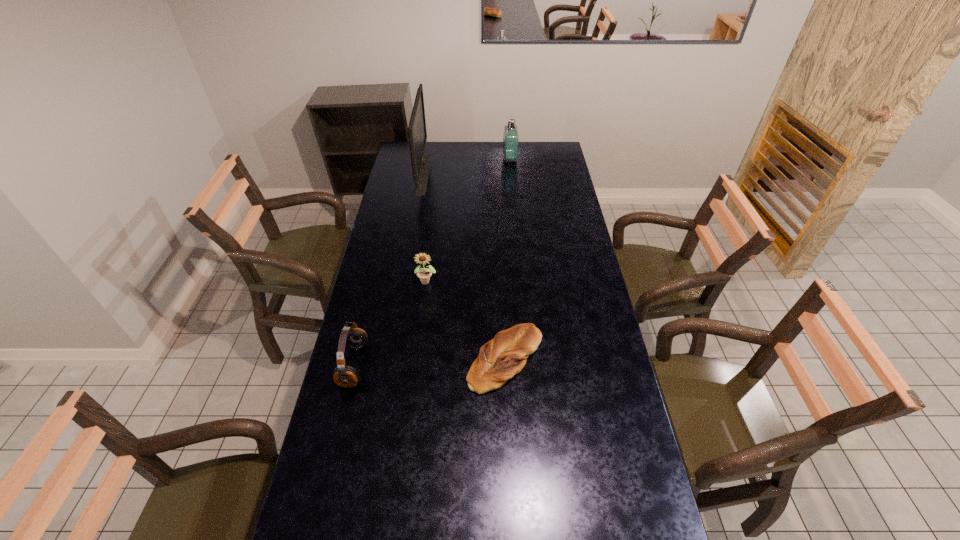
Locate an element on the screen. The image size is (960, 540). vacant space that is in between the fourth shortest object and the bread is located at coordinates (508, 259).

Where is `free area in between the perfume and the sunflower`? free area in between the perfume and the sunflower is located at coordinates (468, 220).

Where is `object that is the second closest one to the bread`? The image size is (960, 540). object that is the second closest one to the bread is located at coordinates [356, 338].

Find the location of a particular element. This screenshot has width=960, height=540. object that is the second closest one to the headset is located at coordinates pyautogui.click(x=501, y=358).

Where is `vacant space that satisfies the following two spatial constraints: 1. on the front-facing side of the tallest object; 2. on the back side of the shortest object`? vacant space that satisfies the following two spatial constraints: 1. on the front-facing side of the tallest object; 2. on the back side of the shortest object is located at coordinates (392, 360).

Where is `free space that satisfies the following two spatial constraints: 1. on the front label of the second tallest object; 2. on the front-facing side of the third nearest object`? This screenshot has width=960, height=540. free space that satisfies the following two spatial constraints: 1. on the front label of the second tallest object; 2. on the front-facing side of the third nearest object is located at coordinates (521, 281).

Locate an element on the screen. vacant space that satisfies the following two spatial constraints: 1. on the front label of the perfume; 2. on the front-facing side of the third object from right to left is located at coordinates click(x=521, y=281).

Identify the location of vacant space that satisfies the following two spatial constraints: 1. on the front label of the second tallest object; 2. on the front side of the shortest object. This screenshot has width=960, height=540. (528, 360).

The width and height of the screenshot is (960, 540). Find the location of `vacant space that satisfies the following two spatial constraints: 1. on the front-facing side of the shortest object; 2. on the right side of the monitor`. vacant space that satisfies the following two spatial constraints: 1. on the front-facing side of the shortest object; 2. on the right side of the monitor is located at coordinates (392, 360).

What are the coordinates of `vacant position in the image that satisfies the following two spatial constraints: 1. on the front-facing side of the shortest object; 2. on the left side of the sunflower` in the screenshot? It's located at (418, 360).